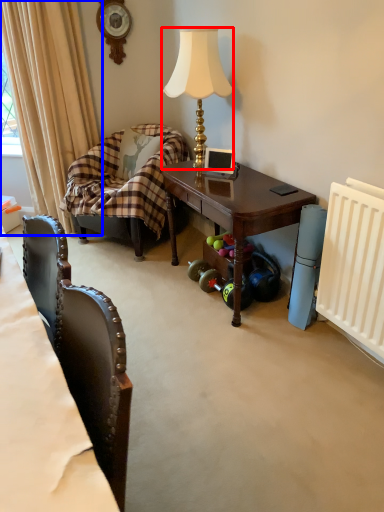
Question: Which point is further to the camera, lamp (highlighted by a red box) or curtain (highlighted by a blue box)?

Choices:
 (A) lamp
 (B) curtain

Answer: (B)